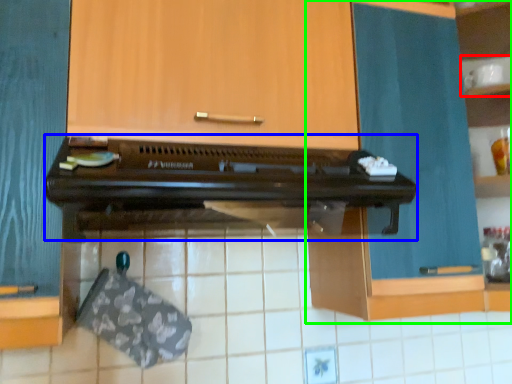
Question: Based on their relative distances, which object is farther from shelf (highlighted by a red box)? Choose from oven (highlighted by a blue box) and cabinetry (highlighted by a green box).

Choices:
 (A) oven
 (B) cabinetry

Answer: (A)